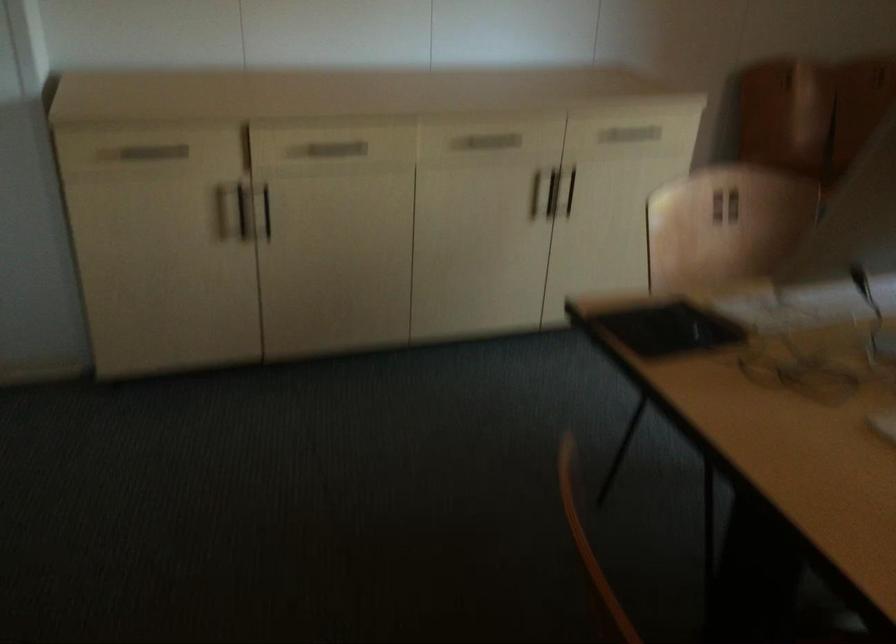
Find where to pull the chair back handle. Please return your answer as a coordinate pair (x, y).

(725, 205)